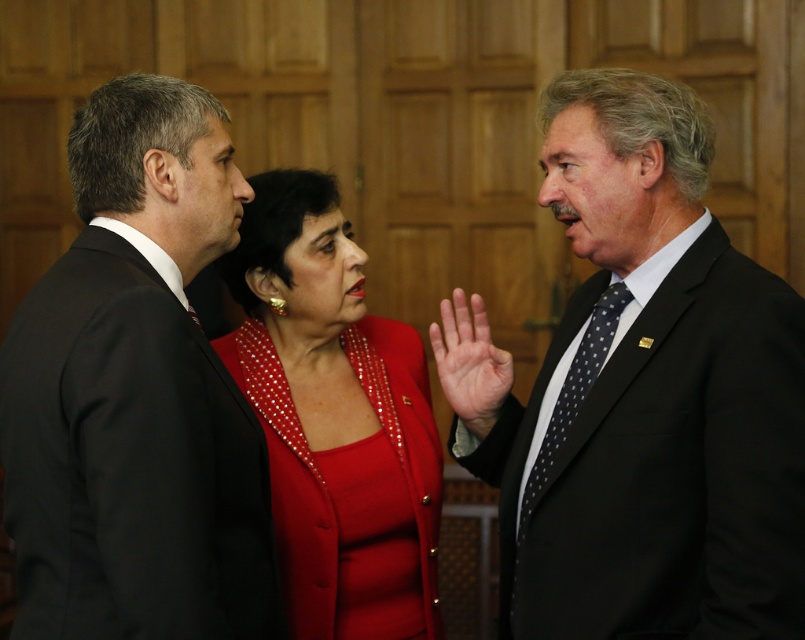
You are standing in the room and need to locate the black suit at left. According to the coordinates provided, where exactly should you look?

The black suit at left is located at coordinates point [135,396].

In the scene shown: You are an event planner trying to arrange seating for a dinner. You need to seat the black suit at right and the shiny red blazer at center according to their current positions in the image. Which one should be seated to the right of the other?

The black suit at right is positioned on the right side of the shiny red blazer at center, so the black suit at right should be seated to the right of the shiny red blazer at center.

You are an event planner arranging seating for a meeting. You need to place a name tag on the table in front of each attendee. The name tag must be placed directly below the attendee. Given the positions of the black suit at right and the shiny red blazer at center, which attendee should have their name tag placed higher on the table?

The black suit at right should have their name tag placed higher on the table because the black suit at right is located above the shiny red blazer at center.